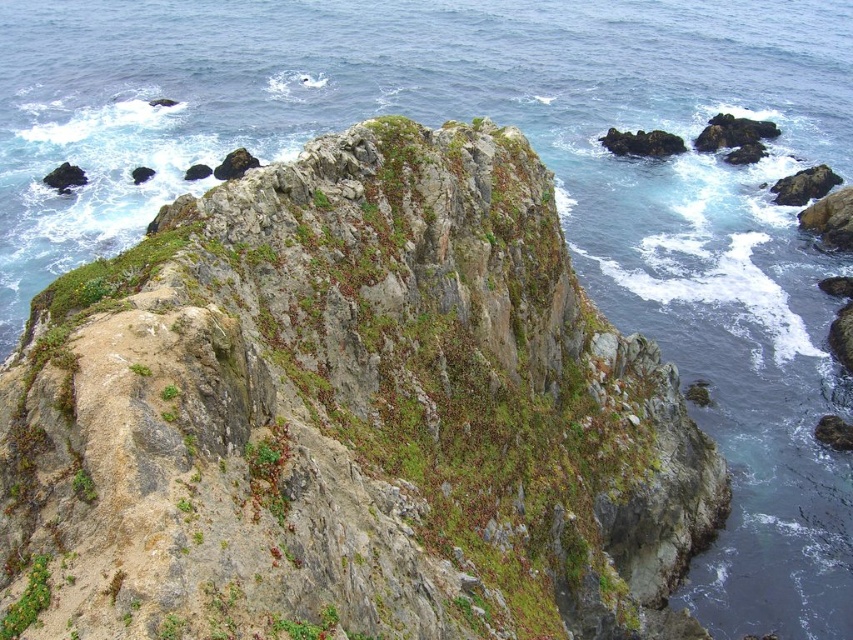
You are standing on the cliff in the image and notice a specific point marked at coordinates (347, 416). What type of feature is located at that point?

The point at coordinates (347, 416) corresponds to green mossy rock at center.

You are a geologist examining the cliff and want to collect samples from both the green mossy rock at center and the green mossy rock at lower left. Which rock should you choose if you need a larger sample?

The green mossy rock at center is bigger than the green mossy rock at lower left, so you should choose the green mossy rock at center for a larger sample.